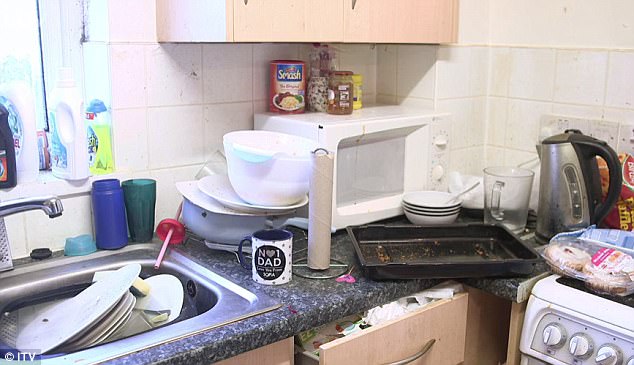
Find the location of a particular element. coffee pot is located at coordinates (567, 158).